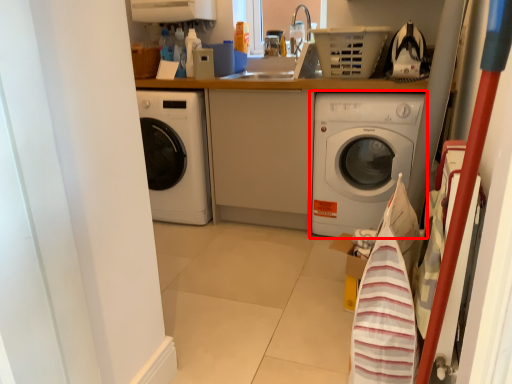
Question: Where is washing machine (annotated by the red box) located in relation to basket in the image?

Choices:
 (A) left
 (B) right

Answer: (B)